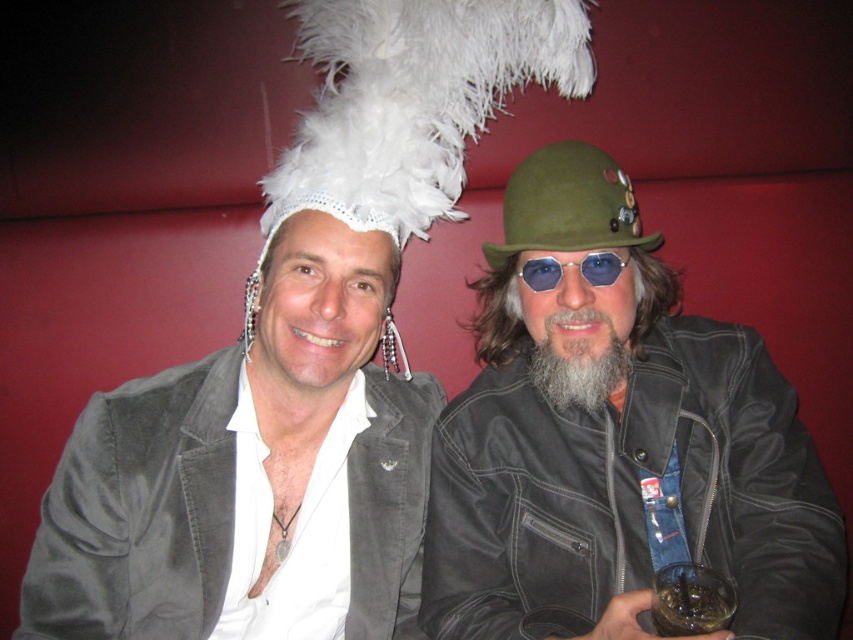
Is point (322, 241) behind point (546, 326)?

No.

Who is shorter, suede jacket at center or graywoollybeard at center?

With less height is graywoollybeard at center.

Does point (300, 289) come closer to viewer compared to point (602, 378)?

Yes, it is.

The image size is (853, 640). Identify the location of suede jacket at center. coord(138,513).

Between leather jacket at center and translucent glass beverage at lower right, which one has less height?

Standing shorter between the two is translucent glass beverage at lower right.

Is leather jacket at center bigger than translucent glass beverage at lower right?

Yes, leather jacket at center is bigger than translucent glass beverage at lower right.

The width and height of the screenshot is (853, 640). Describe the element at coordinates (616, 442) in the screenshot. I see `leather jacket at center` at that location.

Find the location of a particular element. The image size is (853, 640). leather jacket at center is located at coordinates (616, 442).

Is graywoollybeard at center taller than blue reflective lenses at center?

Indeed, graywoollybeard at center has a greater height compared to blue reflective lenses at center.

Is graywoollybeard at center further to camera compared to blue reflective lenses at center?

That is True.

Is point (561, 400) farther from camera compared to point (538, 285)?

Yes.

Identify the location of graywoollybeard at center. The width and height of the screenshot is (853, 640). (579, 362).